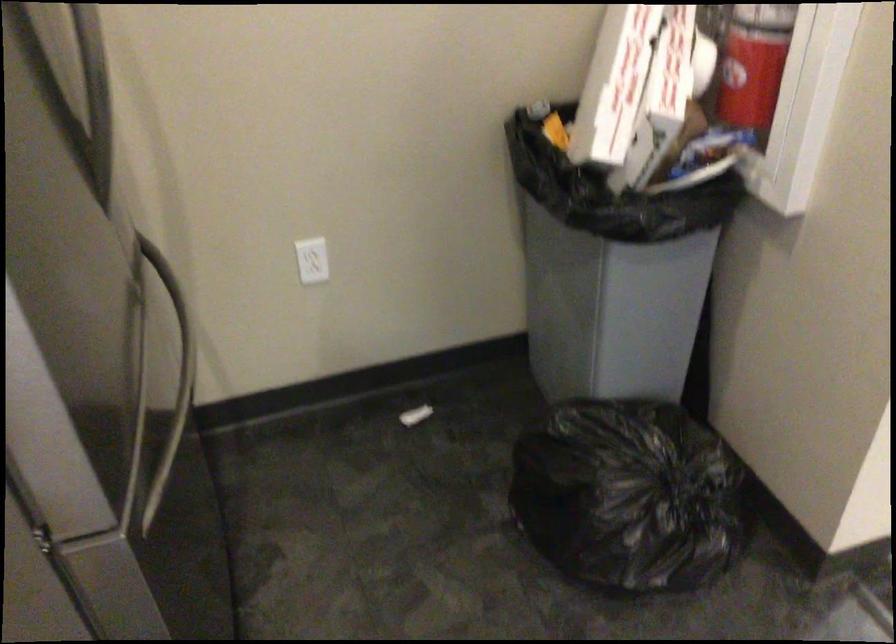
Which object does [629,496] point to?

It refers to a black trash bag.